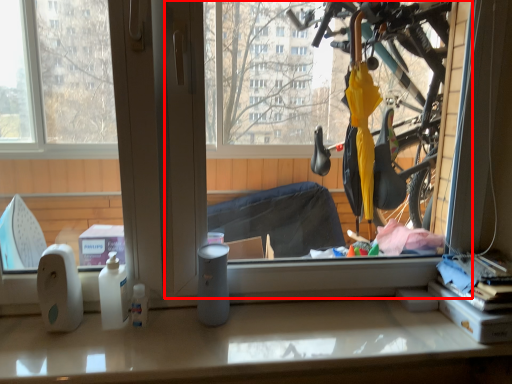
Question: Considering the relative positions of window screen (annotated by the red box) and counter top in the image provided, where is window screen (annotated by the red box) located with respect to the staircase?

Choices:
 (A) right
 (B) left

Answer: (A)